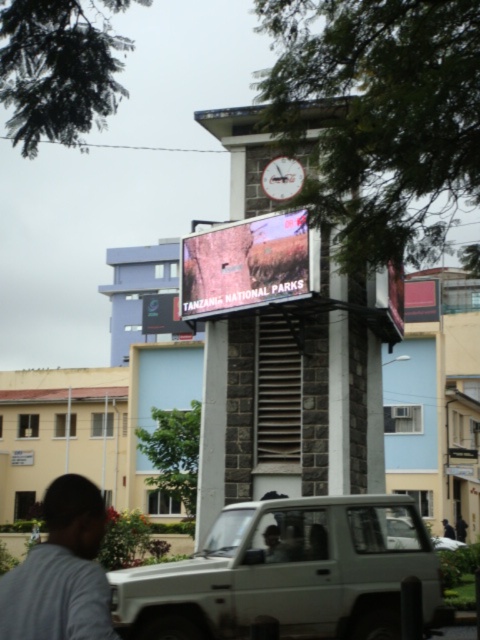
Question: Can you confirm if matte white suv at center is positioned to the right of matte digital display at center?

Choices:
 (A) no
 (B) yes

Answer: (B)

Question: Which of the following is the farthest from the observer?

Choices:
 (A) matte white suv at center
 (B) silver metallic suv at center

Answer: (B)

Question: From the image, what is the correct spatial relationship of black glossy sign at center in relation to white plastic clock at upper center?

Choices:
 (A) below
 (B) above

Answer: (A)

Question: Does matte white suv at center have a lesser width compared to silver metallic suv at center?

Choices:
 (A) no
 (B) yes

Answer: (B)

Question: Which object is the closest to the black glossy sign at center?

Choices:
 (A) white plastic clock at upper center
 (B) matte white suv at center
 (C) silver metallic suv at center
 (D) gray matte shirt at lower left

Answer: (A)

Question: Estimate the real-world distances between objects in this image. Which object is closer to the silver metallic suv at center?

Choices:
 (A) matte digital display at center
 (B) gray matte shirt at lower left

Answer: (A)